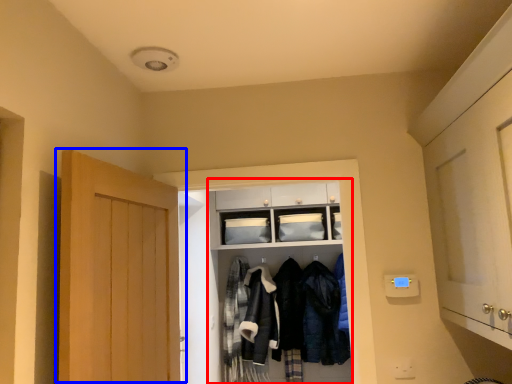
Question: Among these objects, which one is nearest to the camera, closet (highlighted by a red box) or door (highlighted by a blue box)?

Choices:
 (A) closet
 (B) door

Answer: (B)